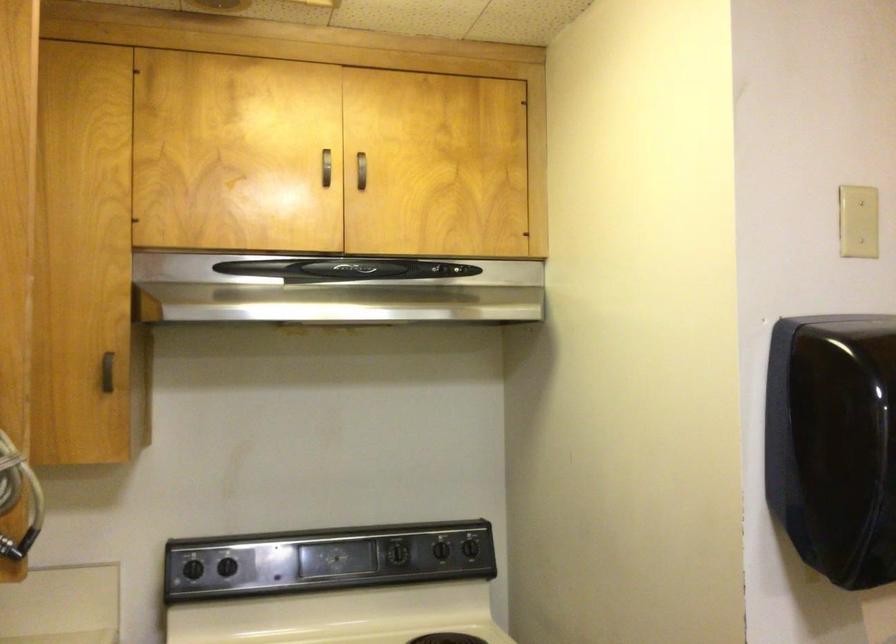
At what (x,y) coordinates should I click in order to perform the action: click on dark cabinet handle. Please return your answer as a coordinate pair (x, y). This screenshot has width=896, height=644. Looking at the image, I should click on (107, 372).